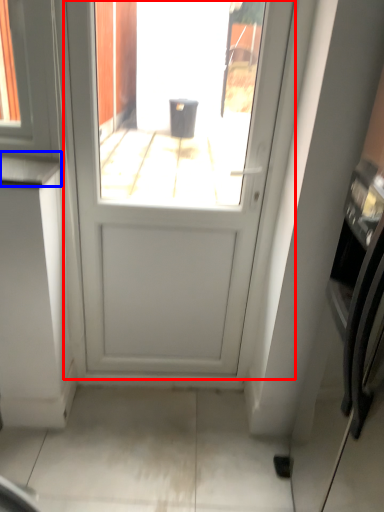
Question: Which object is closer to the camera taking this photo, door (highlighted by a red box) or counter top (highlighted by a blue box)?

Choices:
 (A) door
 (B) counter top

Answer: (A)